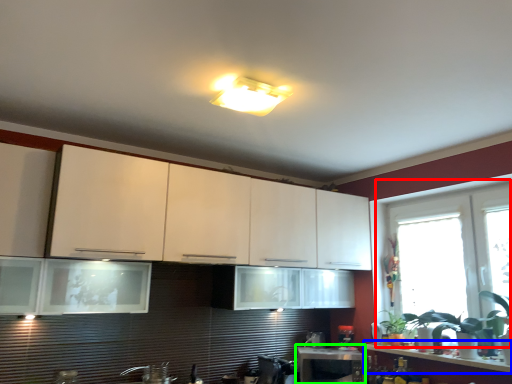
Question: Which is farther away from window (highlighted by a red box)? countertop (highlighted by a blue box) or table (highlighted by a green box)?

Choices:
 (A) countertop
 (B) table

Answer: (B)